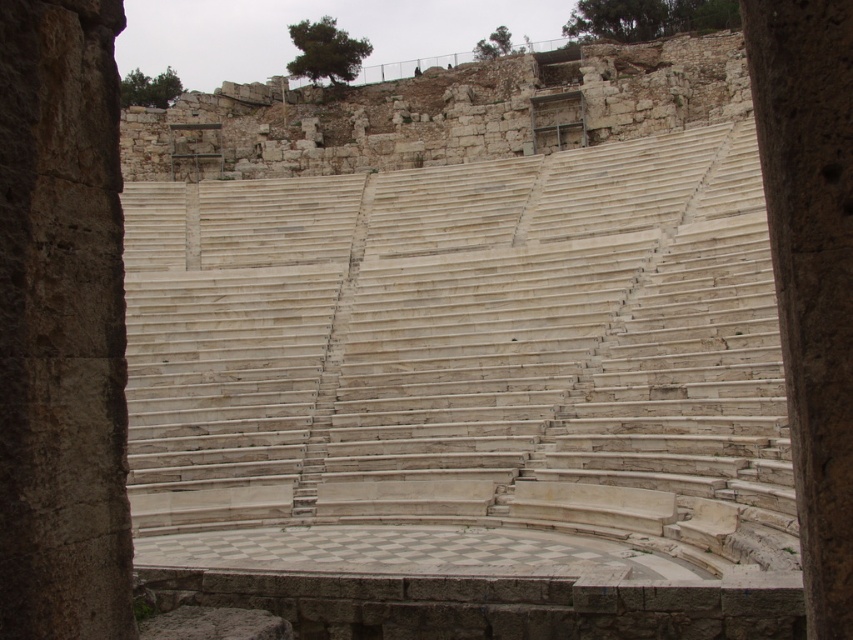
You are an architect examining the ancient stone amphitheater. You notice two pillars, the smooth stone pillar at left and the smooth stone pillar at center. Which pillar is wider?

The smooth stone pillar at center is wider than the smooth stone pillar at left.

You are standing at the entrance of the ancient stone amphitheater and see the smooth stone pillar at left and the smooth stone pillar at center. Which pillar is located to the left of the other?

The smooth stone pillar at left is positioned on the left side of the smooth stone pillar at center.